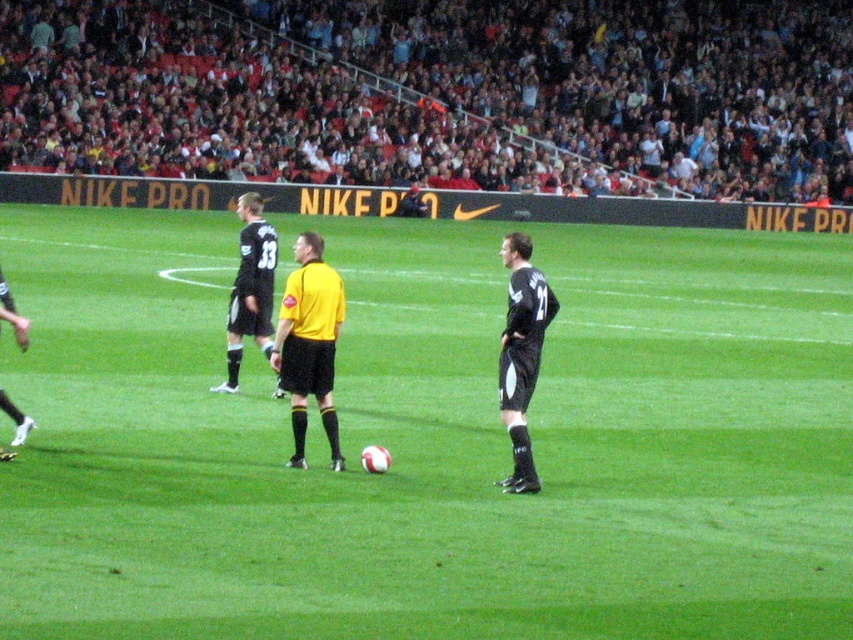
Can you confirm if black jersey at right is positioned to the left of black jersey at left?

Incorrect, black jersey at right is not on the left side of black jersey at left.

Can you confirm if black jersey at right is smaller than black jersey at left?

Incorrect, black jersey at right is not smaller in size than black jersey at left.

Measure the distance between black jersey at right and camera.

A distance of 9.17 meters exists between black jersey at right and camera.

You are a GUI agent. You are given a task and a screenshot of the screen. Output one action in this format:
    pyautogui.click(x=<x>, y=<y>)
    Task: Click on the black jersey at right
    This screenshot has height=640, width=853.
    Given the screenshot: What is the action you would take?
    pyautogui.click(x=521, y=353)

Can you confirm if green grass soccer ball at center is bigger than black jersey at center?

Indeed, green grass soccer ball at center has a larger size compared to black jersey at center.

Between point (392, 346) and point (241, 208), which one is positioned behind?

The point (392, 346) is behind.

Image resolution: width=853 pixels, height=640 pixels. Describe the element at coordinates (430, 436) in the screenshot. I see `green grass soccer ball at center` at that location.

Locate an element on the screen. Image resolution: width=853 pixels, height=640 pixels. green grass soccer ball at center is located at coordinates (430, 436).

Is black jersey at center below black jersey at left?

No, black jersey at center is not below black jersey at left.

Who is higher up, black jersey at center or black jersey at left?

black jersey at center is higher up.

Is point (263, 225) positioned after point (25, 333)?

Yes.

Image resolution: width=853 pixels, height=640 pixels. I want to click on black jersey at center, so click(x=250, y=288).